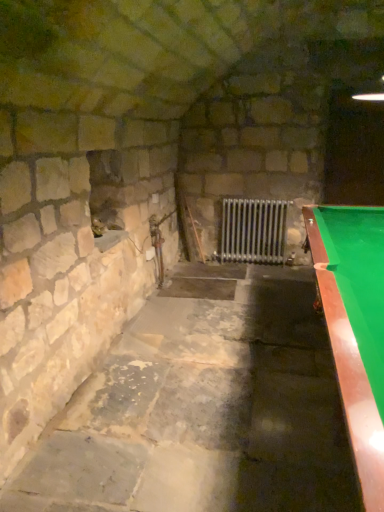
Consider the image. What is the approximate width of green felt pool table at right?

green felt pool table at right is 25.97 inches in width.

The height and width of the screenshot is (512, 384). What do you see at coordinates (355, 326) in the screenshot? I see `green felt pool table at right` at bounding box center [355, 326].

The image size is (384, 512). What are the coordinates of `green felt pool table at right` in the screenshot? It's located at (355, 326).

What do you see at coordinates (253, 230) in the screenshot? The height and width of the screenshot is (512, 384). I see `metallic silver radiator at center` at bounding box center [253, 230].

What is the approximate height of metallic silver radiator at center?

29.51 inches.

Find the location of a particular element. The height and width of the screenshot is (512, 384). metallic silver radiator at center is located at coordinates (253, 230).

You are a GUI agent. You are given a task and a screenshot of the screen. Output one action in this format:
    pyautogui.click(x=<x>, y=<y>)
    Task: Click on the green felt pool table at right
    The height and width of the screenshot is (512, 384).
    Given the screenshot: What is the action you would take?
    pyautogui.click(x=355, y=326)

Is green felt pool table at right at the right side of metallic silver radiator at center?

Correct, you'll find green felt pool table at right to the right of metallic silver radiator at center.

Who is more distant, green felt pool table at right or metallic silver radiator at center?

metallic silver radiator at center is further from the camera.

Considering the points (377, 348) and (284, 211), which point is behind, point (377, 348) or point (284, 211)?

Positioned behind is point (284, 211).

From the image's perspective, would you say green felt pool table at right is positioned over metallic silver radiator at center?

No, from the image's perspective, green felt pool table at right is not over metallic silver radiator at center.

From a real-world perspective, is green felt pool table at right located beneath metallic silver radiator at center?

Incorrect, from a real-world perspective, green felt pool table at right is higher than metallic silver radiator at center.

Considering the sizes of objects green felt pool table at right and metallic silver radiator at center in the image provided, who is thinner, green felt pool table at right or metallic silver radiator at center?

metallic silver radiator at center is thinner.

In terms of height, does green felt pool table at right look taller or shorter compared to metallic silver radiator at center?

green felt pool table at right is taller than metallic silver radiator at center.

Can you confirm if green felt pool table at right is smaller than metallic silver radiator at center?

Incorrect, green felt pool table at right is not smaller in size than metallic silver radiator at center.

Is green felt pool table at right completely or partially outside of metallic silver radiator at center?

That's correct, green felt pool table at right is outside of metallic silver radiator at center.

Is green felt pool table at right beside metallic silver radiator at center?

They are not placed beside each other.

Is green felt pool table at right oriented towards metallic silver radiator at center?

No, green felt pool table at right is not oriented towards metallic silver radiator at center.

In order to click on billiard table located on the right of metallic silver radiator at center in this screenshot , I will do `click(355, 326)`.

Which is more to the right, metallic silver radiator at center or green felt pool table at right?

green felt pool table at right is more to the right.

Does metallic silver radiator at center come in front of green felt pool table at right?

No.

Which point is more forward, [247,244] or [361,210]?

Point [361,210]

From the image's perspective, is metallic silver radiator at center positioned above or below green felt pool table at right?

metallic silver radiator at center is situated higher than green felt pool table at right in the image.

From a real-world perspective, which object stands above the other?

green felt pool table at right.

Which of these two, metallic silver radiator at center or green felt pool table at right, is thinner?

metallic silver radiator at center is thinner.

Who is taller, metallic silver radiator at center or green felt pool table at right?

With more height is green felt pool table at right.

In the scene shown: Does metallic silver radiator at center have a smaller size compared to green felt pool table at right?

Correct, metallic silver radiator at center occupies less space than green felt pool table at right.

Can we say metallic silver radiator at center lies outside green felt pool table at right?

Yes, metallic silver radiator at center is located beyond the bounds of green felt pool table at right.

Would you consider metallic silver radiator at center to be distant from green felt pool table at right?

Yes, metallic silver radiator at center and green felt pool table at right are quite far apart.

Could you tell me if metallic silver radiator at center is turned towards green felt pool table at right?

Yes, metallic silver radiator at center is oriented towards green felt pool table at right.

How many degrees apart are the facing directions of metallic silver radiator at center and green felt pool table at right?

They differ by 90.9 degrees in their facing directions.

In order to click on billiard table in front of the metallic silver radiator at center in this screenshot , I will do (x=355, y=326).

Locate an element on the screen. radiator on the left of green felt pool table at right is located at coordinates (253, 230).

Identify the location of billiard table that is on the right side of metallic silver radiator at center. (355, 326).